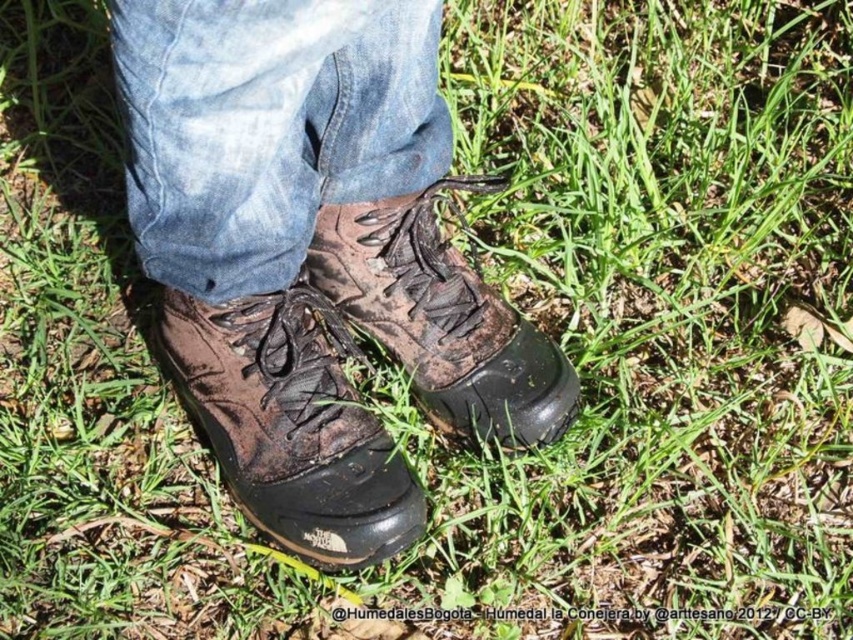
Question: Is denim at center bigger than brown suede boot at center?

Choices:
 (A) no
 (B) yes

Answer: (B)

Question: Which object is closer to the camera taking this photo?

Choices:
 (A) brown leather boot at center
 (B) brown suede boot at center
 (C) denim at center

Answer: (C)

Question: Estimate the real-world distances between objects in this image. Which object is farther from the brown leather boot at center?

Choices:
 (A) brown suede boot at center
 (B) denim at center

Answer: (B)

Question: Can you confirm if denim at center is bigger than brown suede boot at center?

Choices:
 (A) yes
 (B) no

Answer: (A)

Question: Does denim at center appear over brown suede boot at center?

Choices:
 (A) yes
 (B) no

Answer: (A)

Question: Which point is closer to the camera?

Choices:
 (A) brown suede boot at center
 (B) denim at center
 (C) brown leather boot at center

Answer: (B)